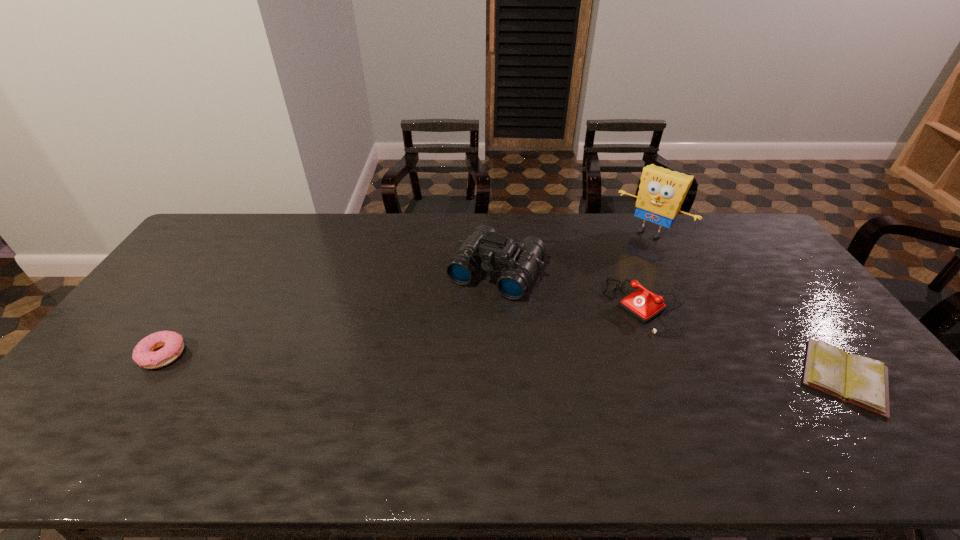
This screenshot has width=960, height=540. In order to click on the leftmost object in this screenshot , I will do `click(145, 355)`.

The image size is (960, 540). In order to click on the second shortest object in this screenshot , I will do `click(145, 355)`.

Find the location of a particular element. Image resolution: width=960 pixels, height=540 pixels. the shortest object is located at coordinates (862, 381).

This screenshot has height=540, width=960. I want to click on the rightmost object, so click(862, 381).

Locate an element on the screen. This screenshot has width=960, height=540. telephone is located at coordinates (644, 305).

This screenshot has height=540, width=960. Identify the location of the second tallest object. (484, 247).

Where is `the fourth object from right to left`? This screenshot has width=960, height=540. the fourth object from right to left is located at coordinates (484, 247).

You are a GUI agent. You are given a task and a screenshot of the screen. Output one action in this format:
    pyautogui.click(x=<x>, y=<y>)
    Task: Click on the tallest object
    This screenshot has width=960, height=540.
    Given the screenshot: What is the action you would take?
    pyautogui.click(x=661, y=193)

Where is `vacant space located on the back of the doughnut`? The image size is (960, 540). vacant space located on the back of the doughnut is located at coordinates (219, 274).

Where is `vacant space located 0.230m on the back of the shortest object`? Image resolution: width=960 pixels, height=540 pixels. vacant space located 0.230m on the back of the shortest object is located at coordinates (776, 285).